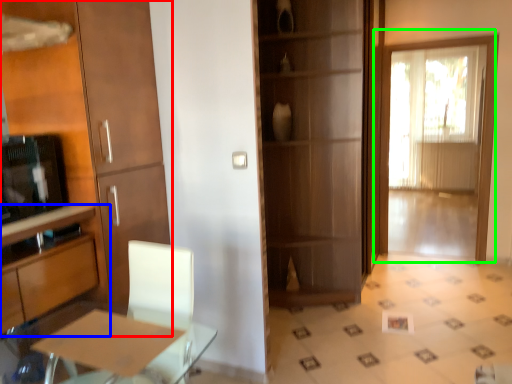
Question: Which is farther away from cabinetry (highlighted by a red box)? cabinetry (highlighted by a blue box) or door (highlighted by a green box)?

Choices:
 (A) cabinetry
 (B) door

Answer: (B)